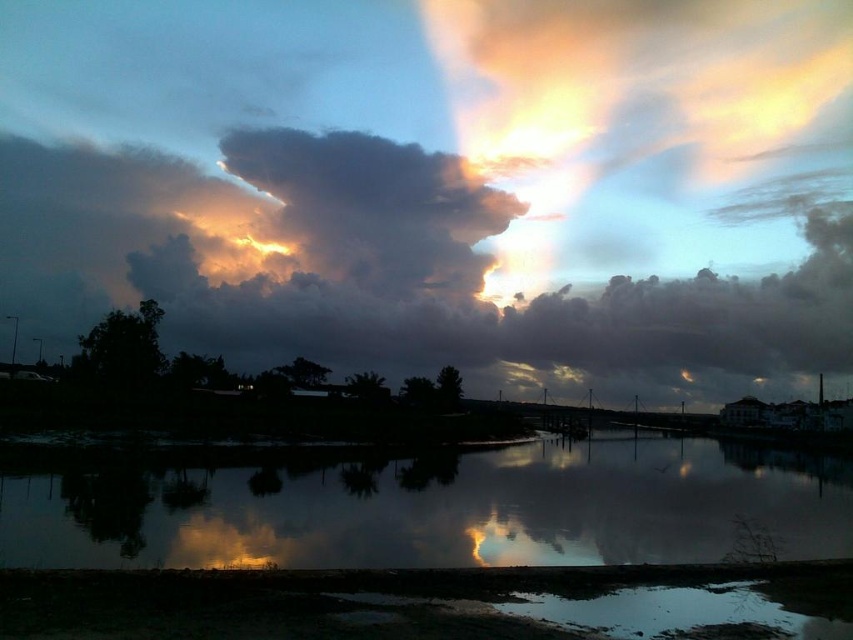
You are an artist trying to paint the sunset scene. You notice the smooth reflective water at center and the dark gray fluffy cloud at upper center. Which one do you think you should paint first if you want to follow the size order from smallest to largest?

The smooth reflective water at center has a smaller size compared to the dark gray fluffy cloud at upper center, so you should paint the smooth reflective water at center first as it is smaller, followed by the dark gray fluffy cloud at upper center.

You are an artist trying to paint the sunset scene. You notice the smooth reflective water at center and the dark gray fluffy cloud at upper center. Which object in the scene is closer to the horizon line?

The smooth reflective water at center is closer to the horizon line because it is shorter than the dark gray fluffy cloud at upper center, meaning it appears lower in the sky.

You are standing at the edge of the water in the sunset scene. There is a point marked at coordinates (431, 508). Based on the description, where is this point located?

The point at (431, 508) is located on the smooth reflective water at center.